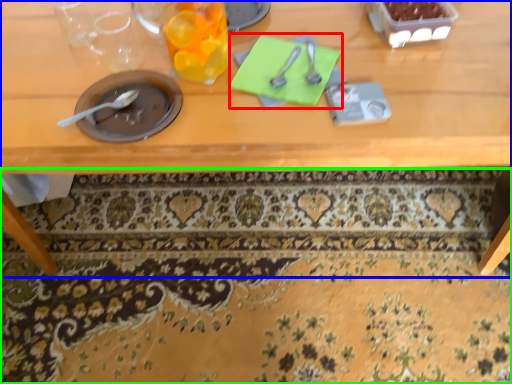
Question: Which object is positioned farthest from notepad (highlighted by a red box)? Select from table (highlighted by a blue box) and mat (highlighted by a green box).

Choices:
 (A) table
 (B) mat

Answer: (B)